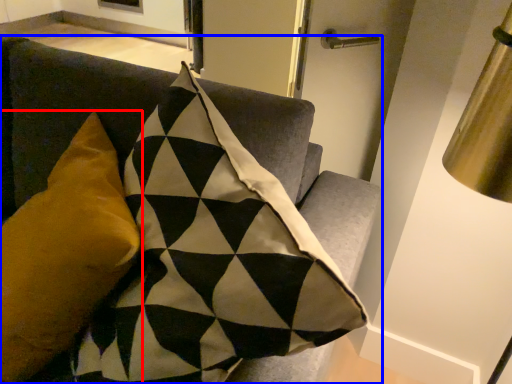
Question: Which of the following is the farthest to the observer, pillow (highlighted by a red box) or furniture (highlighted by a blue box)?

Choices:
 (A) pillow
 (B) furniture

Answer: (A)